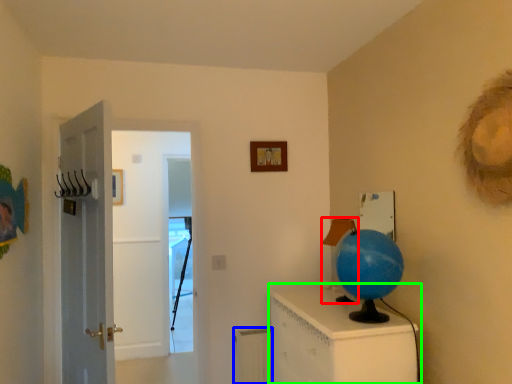
Question: Which is farther away from lamp (highlighted by a red box)? radiator (highlighted by a blue box) or furniture (highlighted by a green box)?

Choices:
 (A) radiator
 (B) furniture

Answer: (A)